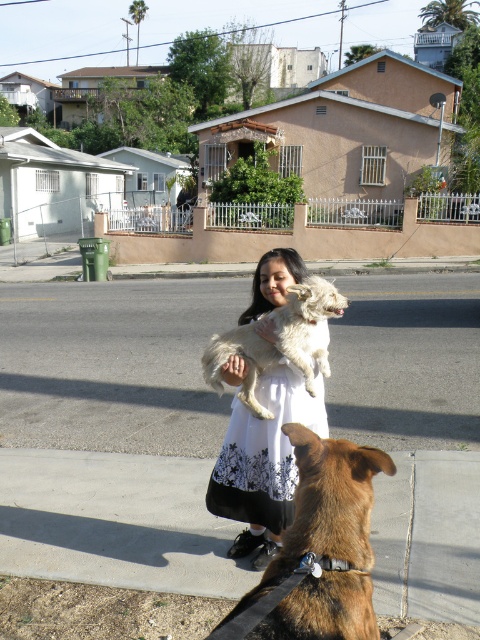
You are a photographer trying to capture a clear photo of the white lace dress at center and the white fluffy dog at center. Since both are white, you want to ensure they are distinguishable in the photo. Which object should you focus on to ensure it stands out more due to its size?

The white lace dress at center has a larger size compared to the white fluffy dog at center, so focusing on the white lace dress at center will make it stand out more due to its larger size.

You are a photographer wanting to capture a clear shot of the white lace dress at center and the white fluffy dog at center. Since the lighting is bright, you want to ensure both subjects are well exposed. Which subject should you adjust your camera settings for first to ensure proper exposure?

The white lace dress at center is thinner than the white fluffy dog at center, so you should adjust your camera settings for the white lace dress at center first. Thinner objects may reflect less light, requiring different exposure settings to avoid underexposure.

You are a delivery robot positioned at the starting point. Your goal is to reach the brown furry dog at lower center without crossing the street. Can you navigate to it by moving only along the sidewalk?

The brown furry dog at lower center is located at point (319, 550), which is on the sidewalk, so yes, the delivery robot can navigate to it without crossing the street by moving along the sidewalk.